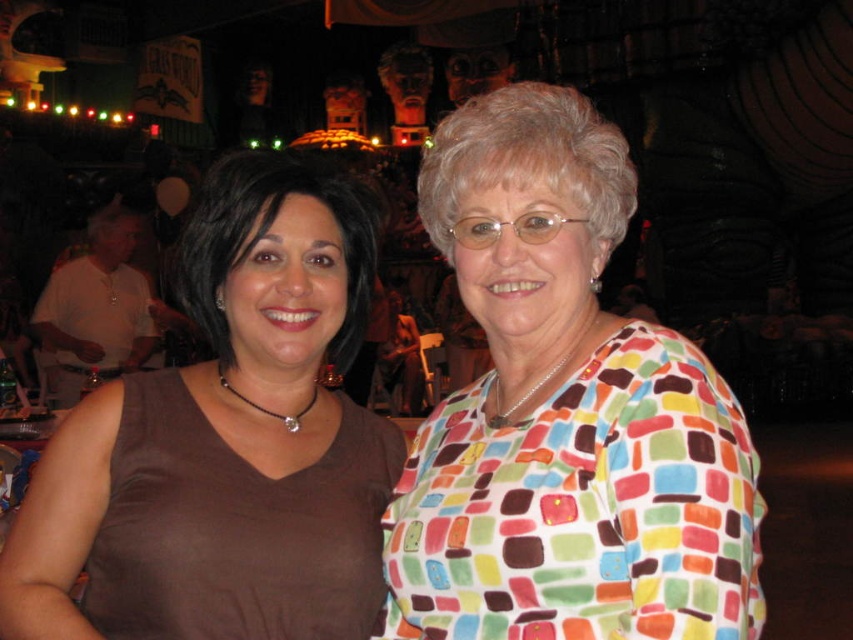
Question: Does multicolored fabric blouse at center come behind matte brown tank top at left?

Choices:
 (A) no
 (B) yes

Answer: (A)

Question: Can you confirm if multicolored fabric blouse at center is positioned to the right of matte brown tank top at left?

Choices:
 (A) yes
 (B) no

Answer: (A)

Question: Does multicolored fabric blouse at center appear over matte brown tank top at left?

Choices:
 (A) yes
 (B) no

Answer: (A)

Question: Which point is closer to the camera?

Choices:
 (A) multicolored fabric blouse at center
 (B) matte brown tank top at left

Answer: (A)

Question: Among these points, which one is farthest from the camera?

Choices:
 (A) (25, 516)
 (B) (515, 260)

Answer: (B)

Question: Which point is farther from the camera taking this photo?

Choices:
 (A) (552, 634)
 (B) (229, 598)

Answer: (B)